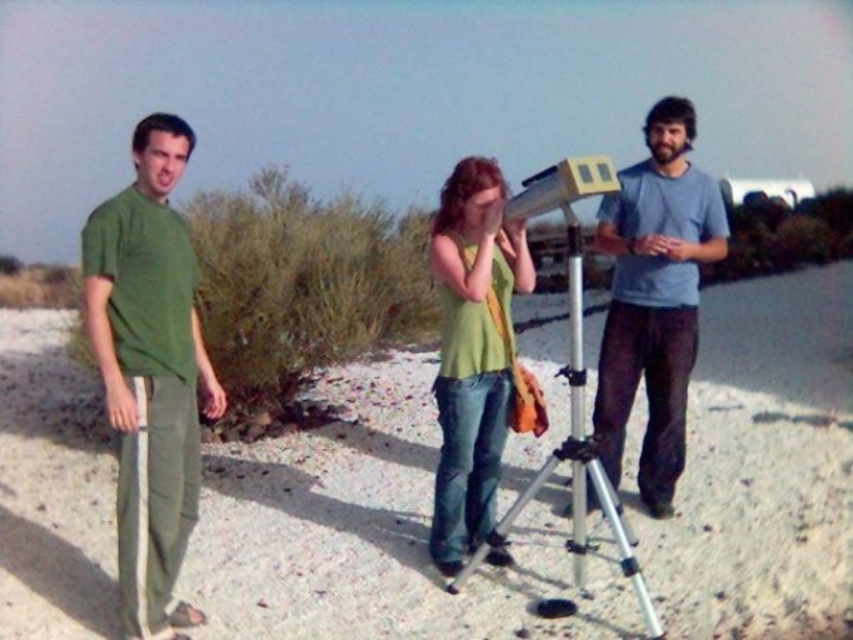
Question: Which of the following is the closest to the observer?

Choices:
 (A) (663, 291)
 (B) (508, 305)
 (C) (556, 372)

Answer: (B)

Question: Estimate the real-world distances between objects in this image. Which object is closer to the light blue t-shirt at center?

Choices:
 (A) white sandy ground at center
 (B) silver metallic tripod at center

Answer: (B)

Question: Is white sandy ground at center closer to the viewer compared to green cotton shirt at left?

Choices:
 (A) no
 (B) yes

Answer: (A)

Question: Which object is the farthest from the light blue t-shirt at center?

Choices:
 (A) green matte tank top at center
 (B) white sandy ground at center

Answer: (B)

Question: Can you confirm if green cotton shirt at left is wider than green matte tank top at center?

Choices:
 (A) no
 (B) yes

Answer: (A)

Question: Where is white sandy ground at center located in relation to light blue t-shirt at center in the image?

Choices:
 (A) left
 (B) right

Answer: (A)